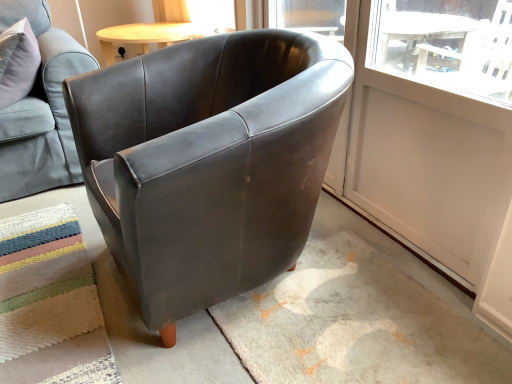
Question: Is white matte screen door at upper right taller than multicolored woven mat at lower left?

Choices:
 (A) yes
 (B) no

Answer: (A)

Question: Is white matte screen door at upper right outside of multicolored woven mat at lower left?

Choices:
 (A) no
 (B) yes

Answer: (B)

Question: Does white matte screen door at upper right contain multicolored woven mat at lower left?

Choices:
 (A) no
 (B) yes

Answer: (A)

Question: From the image's perspective, is white matte screen door at upper right on multicolored woven mat at lower left?

Choices:
 (A) no
 (B) yes

Answer: (B)

Question: Is white matte screen door at upper right aimed at multicolored woven mat at lower left?

Choices:
 (A) no
 (B) yes

Answer: (B)

Question: Is white matte screen door at upper right shorter than multicolored woven mat at lower left?

Choices:
 (A) yes
 (B) no

Answer: (B)

Question: Does matte black armchair at center, the 1th chair when ordered from right to left, turn towards multicolored woven mat at lower left?

Choices:
 (A) no
 (B) yes

Answer: (B)

Question: Is matte black armchair at center, arranged as the 2th chair when viewed from the left, far away from multicolored woven mat at lower left?

Choices:
 (A) yes
 (B) no

Answer: (B)

Question: From the image's perspective, would you say matte black armchair at center, the 1th chair when ordered from right to left, is positioned over multicolored woven mat at lower left?

Choices:
 (A) yes
 (B) no

Answer: (A)

Question: Can you confirm if matte black armchair at center, arranged as the 2th chair when viewed from the left, is thinner than multicolored woven mat at lower left?

Choices:
 (A) yes
 (B) no

Answer: (A)

Question: Does matte black armchair at center, the 1th chair when ordered from right to left, appear on the right side of multicolored woven mat at lower left?

Choices:
 (A) yes
 (B) no

Answer: (A)

Question: Is matte black armchair at center, arranged as the 2th chair when viewed from the left, further to camera compared to multicolored woven mat at lower left?

Choices:
 (A) yes
 (B) no

Answer: (B)

Question: From the image's perspective, would you say matte black armchair at center, arranged as the 2th chair when viewed from the left, is positioned over matte leather armchair at upper left, which ranks as the 2th chair in right-to-left order?

Choices:
 (A) no
 (B) yes

Answer: (A)